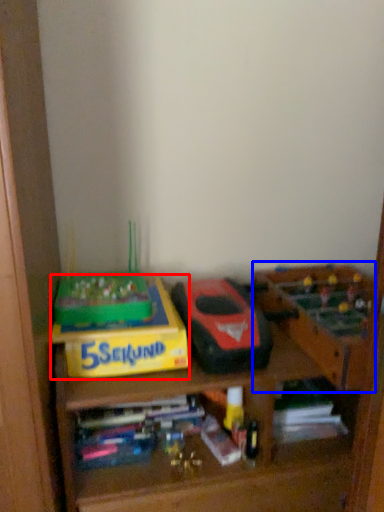
Question: Which point is closer to the camera, cardboard box (highlighted by a red box) or toy (highlighted by a blue box)?

Choices:
 (A) cardboard box
 (B) toy

Answer: (B)